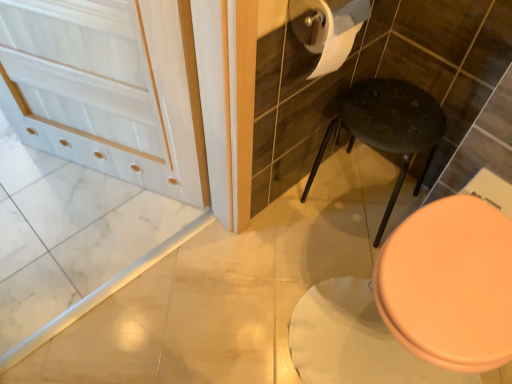
I want to click on free space below white matte screen door at upper left (from a real-world perspective), so click(x=110, y=180).